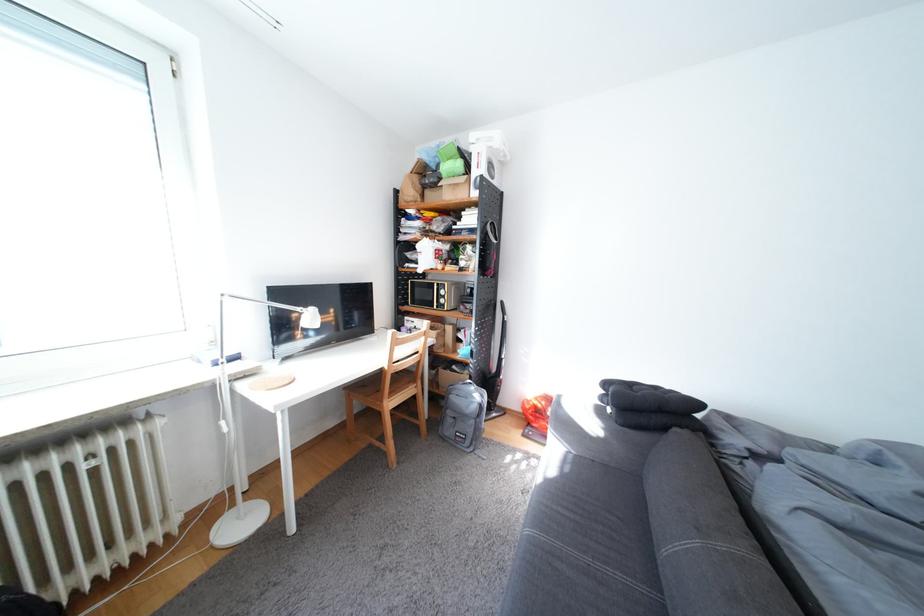
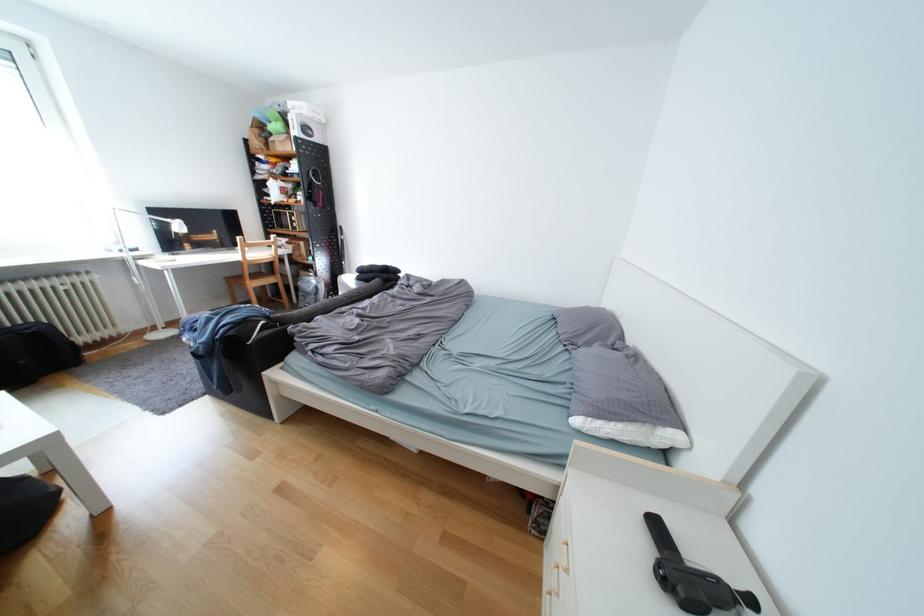
Locate, in the second image, the point that corresponds to [462,413] in the first image.

(313, 294)